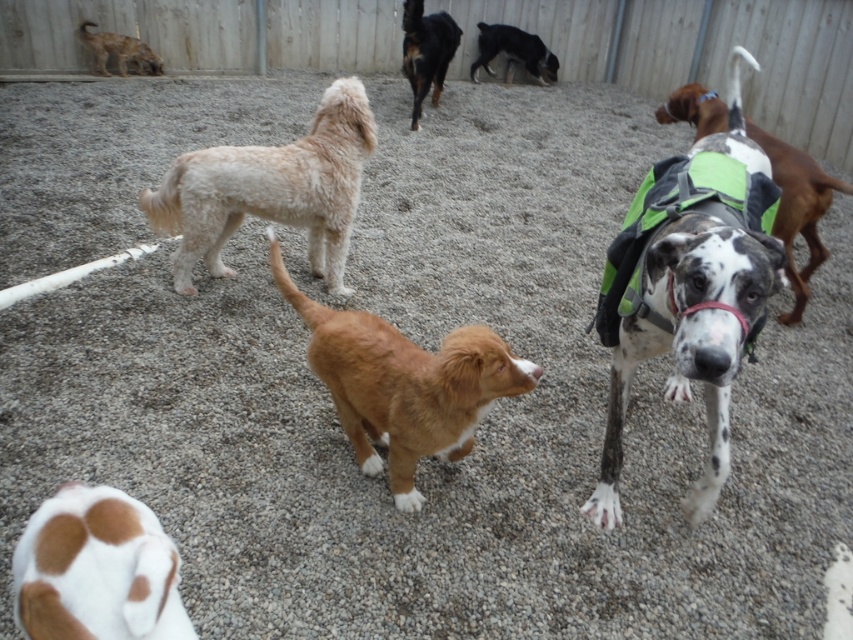
You are a dog owner trying to identify which of your dogs is taller. You have a black glossy dog at upper center and a black and white fur at center. Which one is taller?

The black glossy dog at upper center is much taller than the black and white fur at center.

You are a photographer trying to capture a group photo of the brown fuzzy dog at center and the black glossy dog at upper center. Which dog should you position to the left side in your camera frame?

The brown fuzzy dog at center should be positioned to the left side in your camera frame because it is already on the left side of the black glossy dog at upper center.